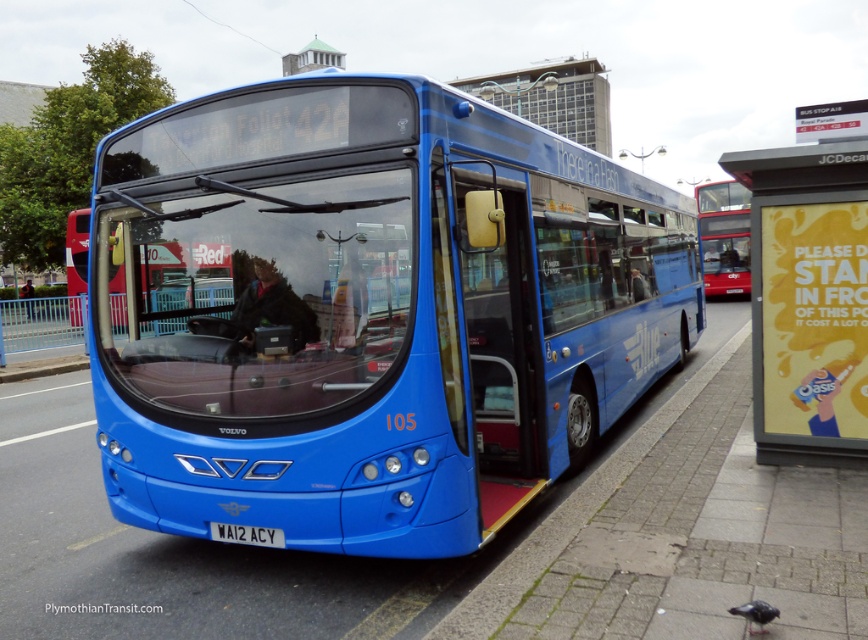
Question: Is smooth concrete pavement at center thinner than red metallic bus at upper right?

Choices:
 (A) yes
 (B) no

Answer: (B)

Question: Which object is the farthest from the dark blue jacket at center?

Choices:
 (A) red metallic bus at upper right
 (B) smooth concrete pavement at center
 (C) blue metallic bus at center

Answer: (C)

Question: Does smooth concrete pavement at center have a larger size compared to white matte license plate at center?

Choices:
 (A) no
 (B) yes

Answer: (B)

Question: Does yellow paper poster at right lie behind white matte license plate at center?

Choices:
 (A) no
 (B) yes

Answer: (B)

Question: Which object is positioned farthest from the blue metallic bus at center?

Choices:
 (A) white matte license plate at center
 (B) yellow paper poster at right
 (C) smooth concrete pavement at center
 (D) dark blue jacket at center

Answer: (D)

Question: Which object is farther from the camera taking this photo?

Choices:
 (A) blue metallic bus at center
 (B) smooth concrete pavement at center
 (C) red metallic bus at upper right

Answer: (C)